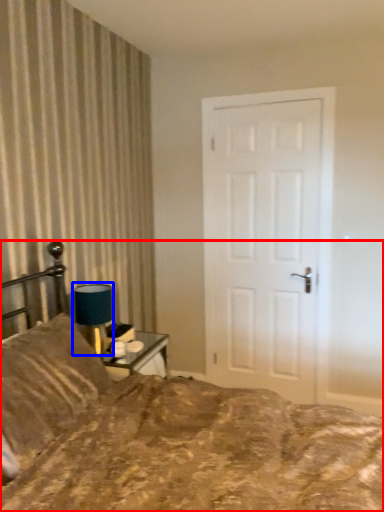
Question: Which of the following is the farthest to the observer, bed (highlighted by a red box) or table lamp (highlighted by a blue box)?

Choices:
 (A) bed
 (B) table lamp

Answer: (B)